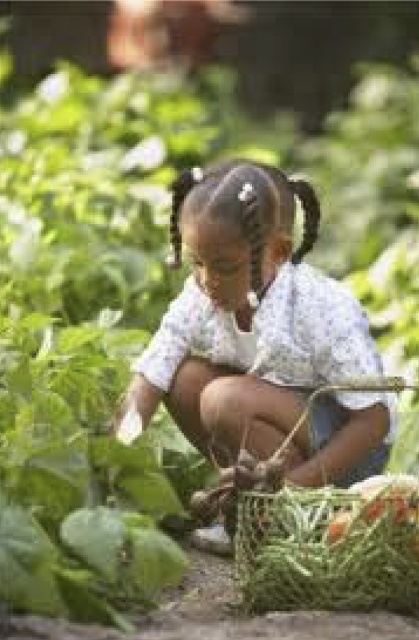
The width and height of the screenshot is (419, 640). What do you see at coordinates (245, 316) in the screenshot?
I see `white floral shirt at center` at bounding box center [245, 316].

Does white floral shirt at center have a greater height compared to green leafy vegetables at lower center?

Yes, white floral shirt at center is taller than green leafy vegetables at lower center.

Describe the element at coordinates (245, 316) in the screenshot. The height and width of the screenshot is (640, 419). I see `white floral shirt at center` at that location.

This screenshot has width=419, height=640. In order to click on white floral shirt at center in this screenshot , I will do `click(245, 316)`.

Looking at this image, can you confirm if white floral shirt at center is positioned to the left of green mesh basket at lower right?

Correct, you'll find white floral shirt at center to the left of green mesh basket at lower right.

Is point (261, 266) positioned before point (286, 573)?

No.

Does point (284, 349) lie in front of point (338, 604)?

That is False.

You are a GUI agent. You are given a task and a screenshot of the screen. Output one action in this format:
    pyautogui.click(x=<x>, y=<y>)
    Task: Click on the white floral shirt at center
    The height and width of the screenshot is (640, 419).
    Given the screenshot: What is the action you would take?
    pyautogui.click(x=245, y=316)

Does green mesh basket at lower right come in front of green leafy vegetables at lower center?

Yes, it is in front of green leafy vegetables at lower center.

Does point (388, 573) lie in front of point (392, 493)?

No, (388, 573) is behind (392, 493).

Where is `green mesh basket at lower right`? green mesh basket at lower right is located at coordinates (330, 548).